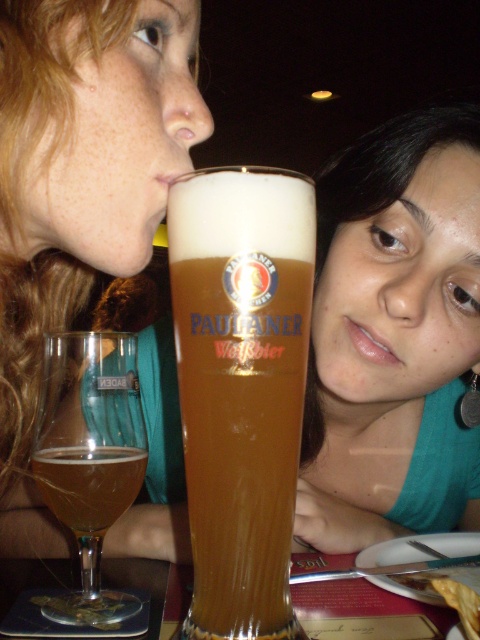
Is golden matte glass at center bigger than translucent glass coaster at lower left?

Incorrect, golden matte glass at center is not larger than translucent glass coaster at lower left.

Can you confirm if golden matte glass at center is taller than translucent glass coaster at lower left?

Indeed, golden matte glass at center has a greater height compared to translucent glass coaster at lower left.

The image size is (480, 640). Describe the element at coordinates (240, 385) in the screenshot. I see `golden matte glass at center` at that location.

Where is `golden matte glass at center`? The width and height of the screenshot is (480, 640). golden matte glass at center is located at coordinates (240, 385).

Is matte black hair at upper left above amber glass at lower left?

Yes.

Between point (69, 253) and point (123, 476), which one is positioned in front?

Positioned in front is point (123, 476).

Measure the distance between matte black hair at upper left and camera.

A distance of 12.15 inches exists between matte black hair at upper left and camera.

The height and width of the screenshot is (640, 480). I want to click on matte black hair at upper left, so click(80, 188).

Consider the image. Who is positioned more to the left, matte black hair at upper left or translucent glass beer glass at lower left?

translucent glass beer glass at lower left is more to the left.

From the picture: Is matte black hair at upper left taller than translucent glass beer glass at lower left?

Indeed, matte black hair at upper left has a greater height compared to translucent glass beer glass at lower left.

Does point (13, 429) lie behind point (82, 525)?

That is True.

Where is `matte black hair at upper left`? matte black hair at upper left is located at coordinates (80, 188).